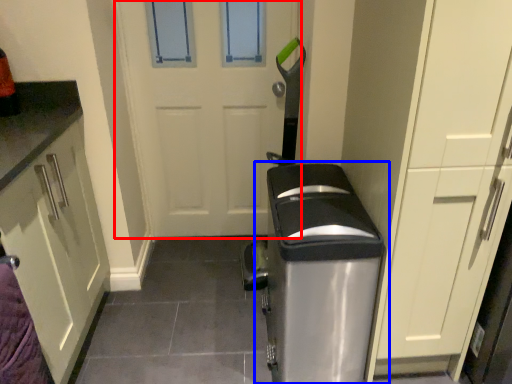
Question: Which object appears farthest to the camera in this image, door (highlighted by a red box) or home appliance (highlighted by a blue box)?

Choices:
 (A) door
 (B) home appliance

Answer: (A)